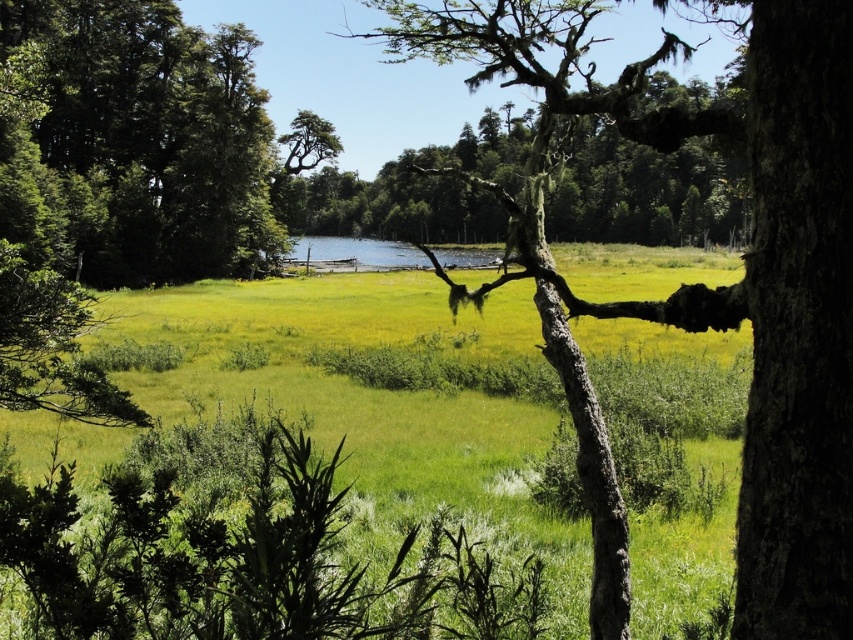
Looking at this image, you are a hiker who wants to take a photo of both the smooth bark tree at center and the clear blue water at center. Which object should you focus on first if you want to capture both in a single frame without moving your camera?

The smooth bark tree at center is bigger than the clear blue water at center, so you should focus on the smooth bark tree at center first to ensure it fills the frame appropriately before adjusting for the smaller clear blue water at center.

You are standing at the center of the image and want to walk towards the green leafy tree at left. In which direction should you move?

You should move towards the left direction to reach the green leafy tree at left since its 2D location is at point (138, 144).